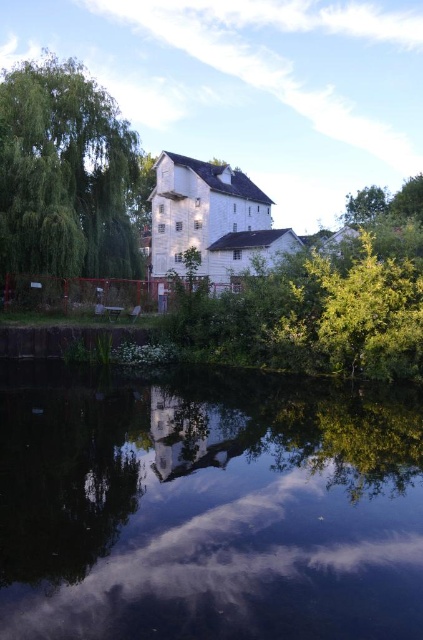
Question: Can you confirm if transparent glass lake at center is thinner than green leafy tree at left?

Choices:
 (A) yes
 (B) no

Answer: (B)

Question: Estimate the real-world distances between objects in this image. Which object is farther from the green leafy tree at upper right?

Choices:
 (A) green leafy tree at left
 (B) transparent glass lake at center

Answer: (B)

Question: Among these objects, which one is nearest to the camera?

Choices:
 (A) green leafy tree at upper right
 (B) green leafy tree at left
 (C) transparent glass lake at center

Answer: (C)

Question: Is green leafy tree at left below green leafy tree at upper right?

Choices:
 (A) yes
 (B) no

Answer: (A)

Question: Which of the following is the closest to the observer?

Choices:
 (A) (13, 252)
 (B) (379, 195)

Answer: (A)

Question: Is transparent glass lake at center to the right of green leafy tree at left from the viewer's perspective?

Choices:
 (A) no
 (B) yes

Answer: (B)